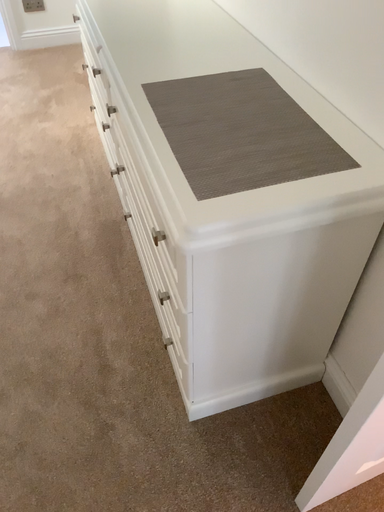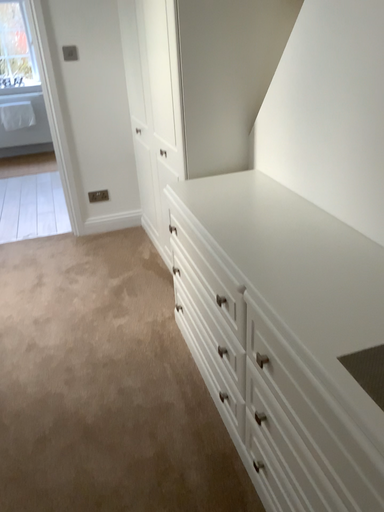
Question: How did the camera likely rotate when shooting the video?

Choices:
 (A) rotated upward
 (B) rotated downward

Answer: (A)